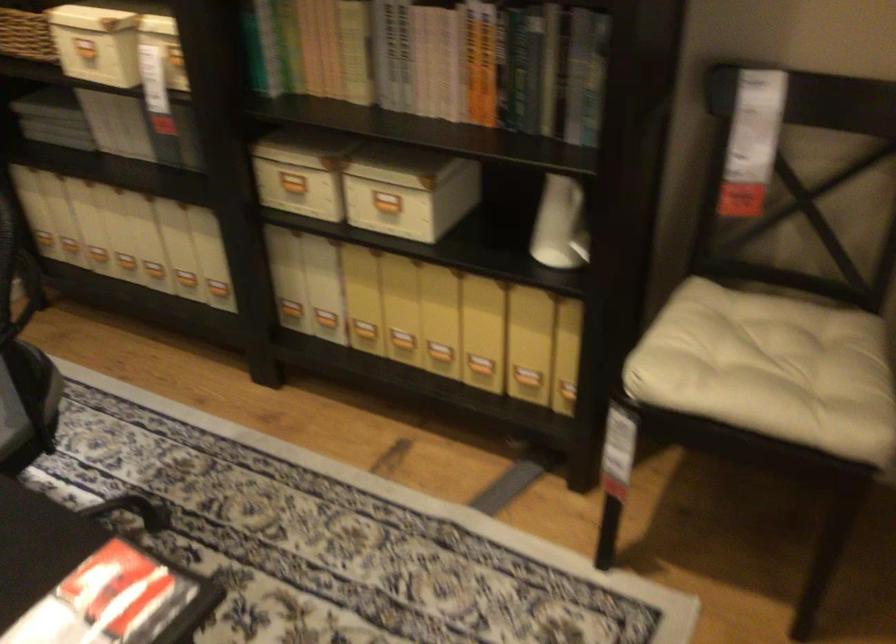
This screenshot has height=644, width=896. Identify the location of file holder handle. (45, 109).